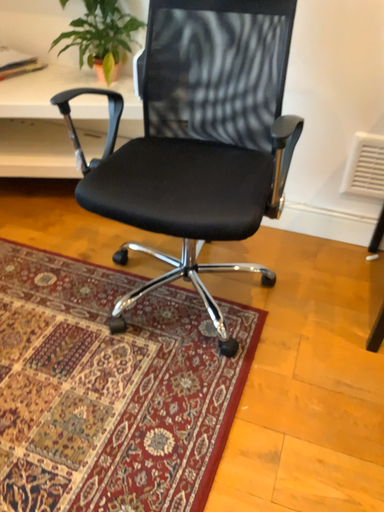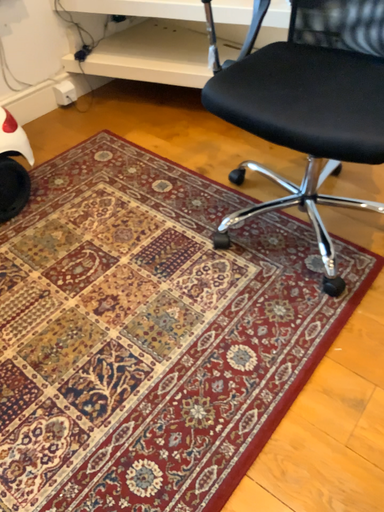
Question: Which way did the camera rotate in the video?

Choices:
 (A) rotated right
 (B) rotated left

Answer: (B)